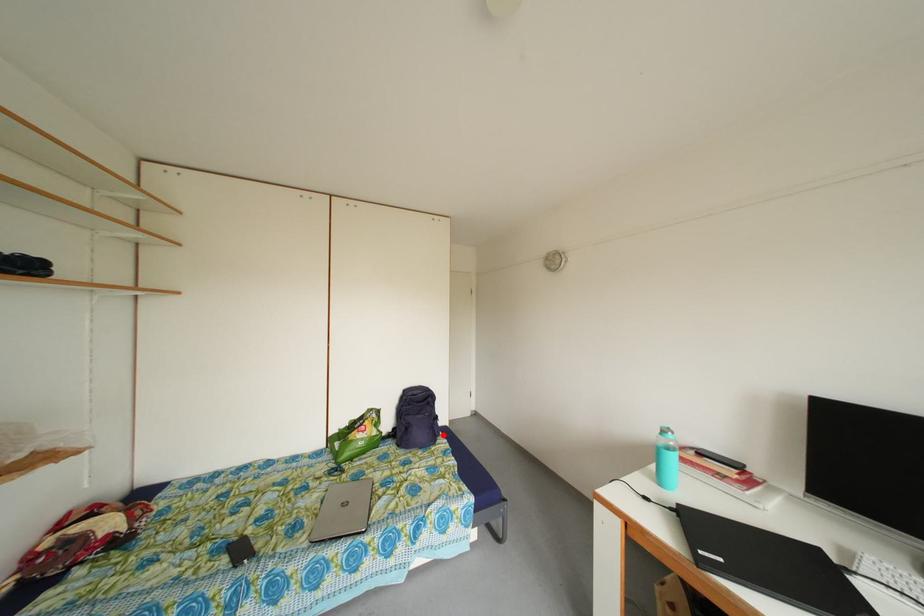
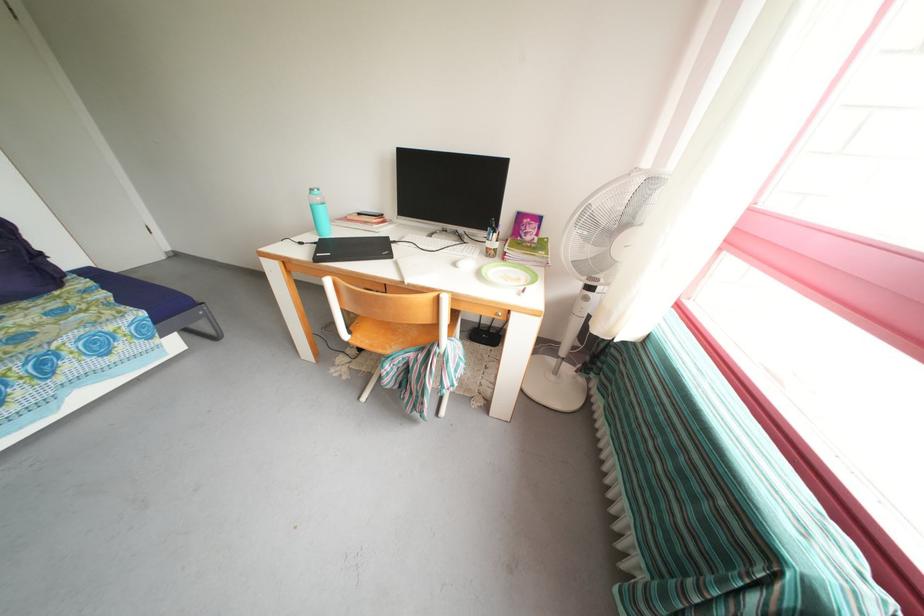
In the second image, find the point that corresponds to the highlighted location in the first image.

(55, 276)